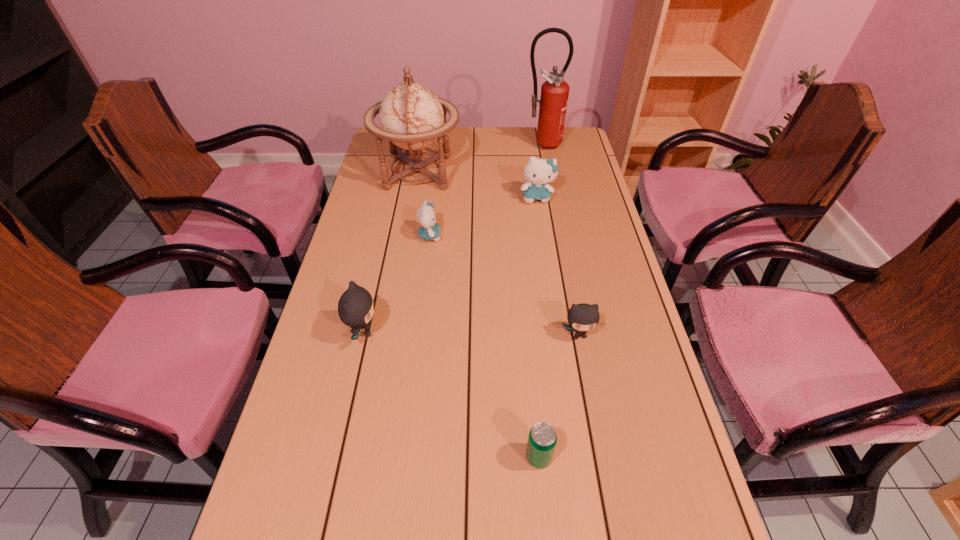
The image size is (960, 540). Identify the location of beer can. (542, 439).

You are a GUI agent. You are given a task and a screenshot of the screen. Output one action in this format:
    pyautogui.click(x=<x>, y=<y>)
    Task: Click on the free space located at the nozzle of the fire extinguisher
    This screenshot has width=960, height=540.
    Given the screenshot: What is the action you would take?
    pyautogui.click(x=551, y=192)

Identify the location of vacant space located 0.360m at the front of the globe showing Africa. (559, 173).

This screenshot has height=540, width=960. I want to click on vacant region located 0.360m on the face of the farther blue kitten, so click(550, 284).

Where is `vacant space located 0.350m on the front-facing side of the left gray kitten`? vacant space located 0.350m on the front-facing side of the left gray kitten is located at coordinates (516, 332).

Identify the location of free point located 0.170m on the face of the third nearest kitten. (495, 236).

Identify the location of vacant position located 0.380m on the front-facing side of the smaller gray kitten. (612, 511).

The width and height of the screenshot is (960, 540). I want to click on blank space located 0.320m on the left of the nearest object, so click(369, 457).

What are the coordinates of `fire extinguisher that is at the far edge` in the screenshot? It's located at (x=553, y=102).

Where is `globe that is at the far edge`? Image resolution: width=960 pixels, height=540 pixels. globe that is at the far edge is located at coordinates (412, 117).